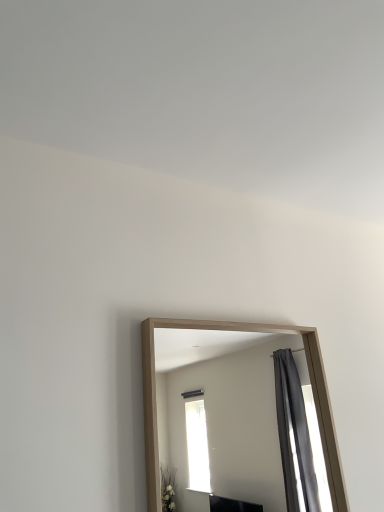
In order to click on light wood mirror at center in this screenshot , I will do `click(229, 414)`.

What do you see at coordinates (229, 414) in the screenshot? I see `light wood mirror at center` at bounding box center [229, 414].

Find the location of a particular element. Image resolution: width=384 pixels, height=512 pixels. light wood mirror at center is located at coordinates click(229, 414).